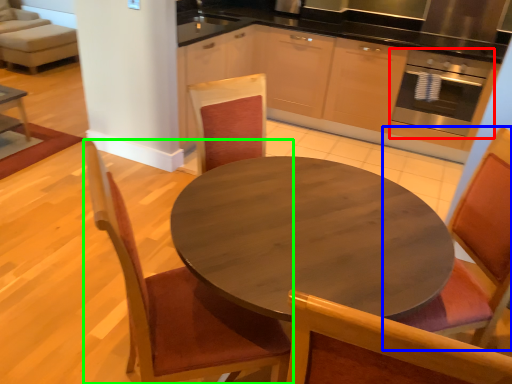
Question: Which is nearer to the oven (highlighted by a red box)? chair (highlighted by a blue box) or chair (highlighted by a green box).

Choices:
 (A) chair
 (B) chair

Answer: (A)